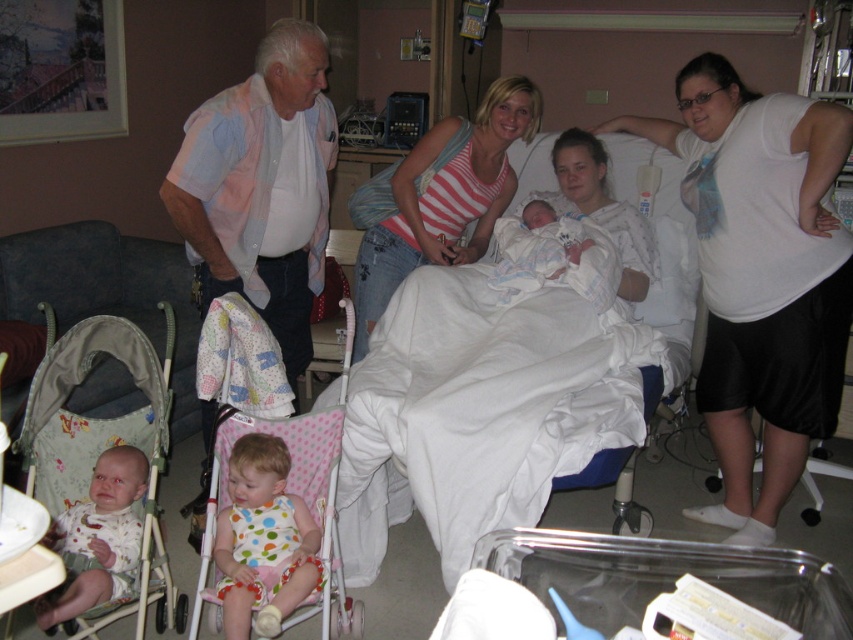
You are a nurse entering the hospital room and need to place a medical kit on the surface that is higher between the white fabric hospital bed at center and the matte white blanket at center. Which surface should you choose?

The white fabric hospital bed at center is higher than the matte white blanket at center, so you should place the medical kit on the white fabric hospital bed at center.

Looking at this image, you are a photographer in the room and want to capture a photo that includes both the white matte shirt at upper right and the white polka dot dress at lower left. Which object should you focus on first to ensure both are in frame?

You should focus on the white polka dot dress at lower left first because the white matte shirt at upper right is located above it, so adjusting the camera angle downward from the dress would capture both.

You are a nurse in the hospital room and need to locate the pink cotton shirt at left. Where would you find it?

The pink cotton shirt at left is located at the coordinates point (260, 188).